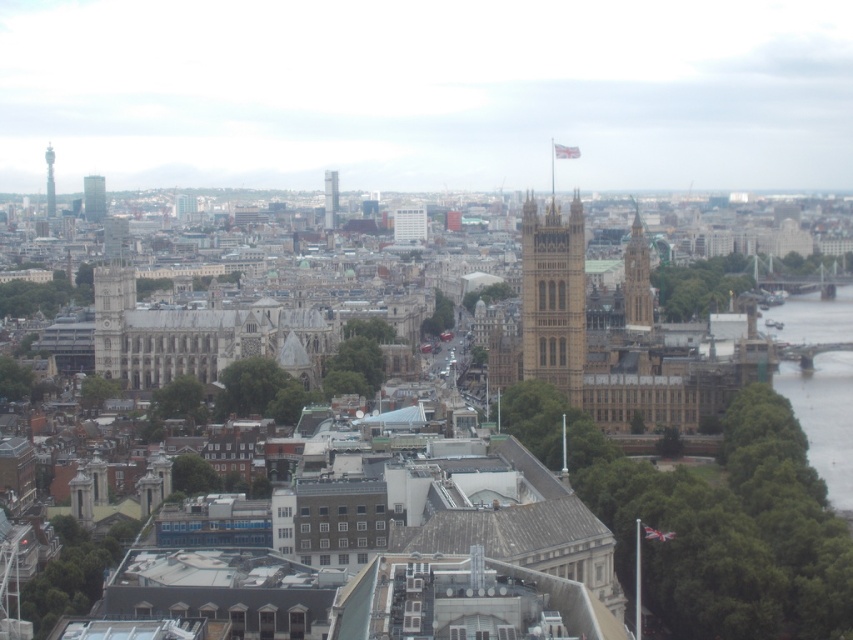
Question: Among these points, which one is farthest from the camera?

Choices:
 (A) (552, 346)
 (B) (100, 196)

Answer: (B)

Question: Among these points, which one is nearest to the camera?

Choices:
 (A) (646, 241)
 (B) (86, 186)
 (C) (527, 278)
 (D) (51, 193)

Answer: (C)

Question: Can you confirm if stone tower at left is thinner than silver metallic tower at left?

Choices:
 (A) no
 (B) yes

Answer: (A)

Question: Which object is the closest to the golden stone tower at center?

Choices:
 (A) stone tower at left
 (B) silver metallic tower at left
 (C) glassy reflective skyscraper at upper left

Answer: (A)

Question: Is glassy reflective skyscraper at upper left thinner than silver metallic tower at left?

Choices:
 (A) yes
 (B) no

Answer: (B)

Question: Considering the relative positions of golden stone tower at center right and smooth glass skyscraper at center in the image provided, where is golden stone tower at center right located with respect to smooth glass skyscraper at center?

Choices:
 (A) above
 (B) below

Answer: (B)